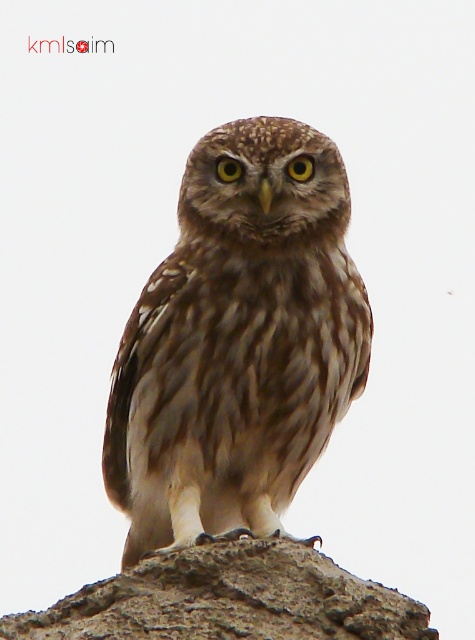
Does brown speckled owl at center have a greater width compared to gray rough stone at center?

Incorrect, brown speckled owl at center's width does not surpass gray rough stone at center's.

Is point (298, 177) in front of point (348, 621)?

No, (298, 177) is further to viewer.

Is point (361, 372) behind point (244, 632)?

Yes, it is.

The image size is (475, 640). I want to click on brown speckled owl at center, so click(x=237, y=340).